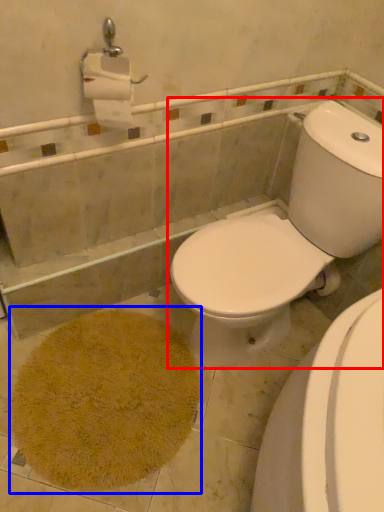
Question: Which of the following is the closest to the observer, toilet (highlighted by a red box) or bath mat (highlighted by a blue box)?

Choices:
 (A) toilet
 (B) bath mat

Answer: (A)